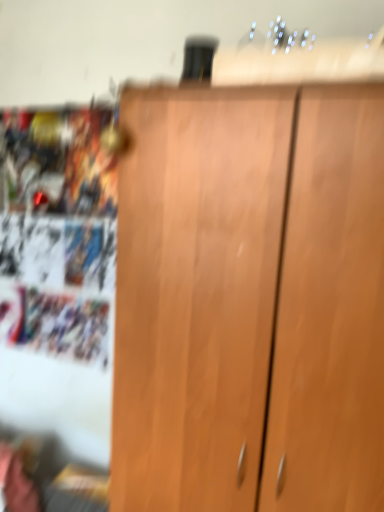
What do you see at coordinates (250, 300) in the screenshot?
I see `light brown wood cupboard at center` at bounding box center [250, 300].

Find the location of a particular element. This screenshot has width=384, height=512. light brown wood cupboard at center is located at coordinates (250, 300).

What is the approximate height of light brown wood cupboard at center?

light brown wood cupboard at center is 5.03 feet in height.

Where is `light brown wood cupboard at center`? The width and height of the screenshot is (384, 512). light brown wood cupboard at center is located at coordinates (250, 300).